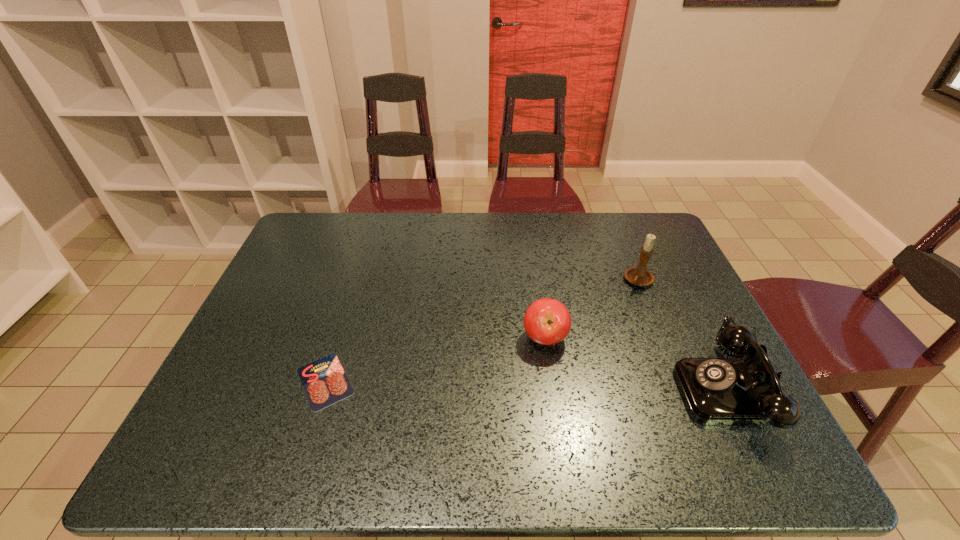
What are the coordinates of `vacant space on the desktop that is between the salami and the telephone and is positioned on the side of the tallest object with the handle` in the screenshot? It's located at (551, 386).

What are the coordinates of `vacant space on the desktop that is between the shortest object and the telephone and is positioned on the stem of the third object from right to left` in the screenshot? It's located at (488, 384).